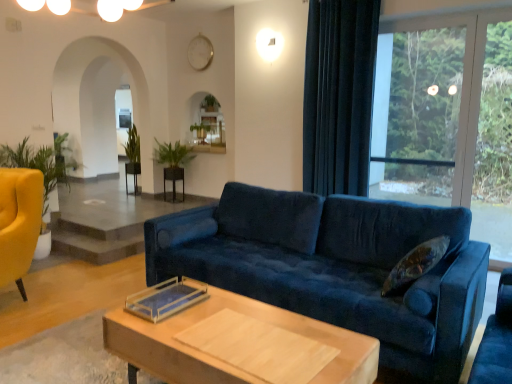
The height and width of the screenshot is (384, 512). Describe the element at coordinates (200, 52) in the screenshot. I see `silver metallic clock at upper center` at that location.

What do you see at coordinates (132, 145) in the screenshot? The image size is (512, 384). I see `green leafy plant at center, placed as the second plant when sorted from front to back` at bounding box center [132, 145].

At what (x,y) coordinates should I click in order to perform the action: click on black wood side table at center, the 1th side table from the front. Please return your answer as a coordinate pair (x, y). The height and width of the screenshot is (384, 512). Looking at the image, I should click on (174, 182).

Where is `silver metallic clock at upper center`? silver metallic clock at upper center is located at coordinates (200, 52).

Considering the relative sizes of silver metallic clock at upper center and velvet dark blue curtain at right in the image provided, is silver metallic clock at upper center smaller than velvet dark blue curtain at right?

Yes, silver metallic clock at upper center is smaller than velvet dark blue curtain at right.

From a real-world perspective, is silver metallic clock at upper center positioned above or below velvet dark blue curtain at right?

silver metallic clock at upper center is above velvet dark blue curtain at right.

Are silver metallic clock at upper center and velvet dark blue curtain at right far apart?

Yes, silver metallic clock at upper center and velvet dark blue curtain at right are quite far apart.

Consider the image. Which object is further away from the camera, light wood/wooden coffee table at center or green leafy plant at center, placed as the 2th plant when sorted from back to front?

green leafy plant at center, placed as the 2th plant when sorted from back to front, is further from the camera.

Are light wood/wooden coffee table at center and green leafy plant at center, the 1th plant when ordered from right to left, making contact?

No, light wood/wooden coffee table at center is not with green leafy plant at center, the 1th plant when ordered from right to left.

Looking at this image, who is smaller, light wood/wooden coffee table at center or green leafy plant at center, placed as the 2th plant when sorted from back to front?

green leafy plant at center, placed as the 2th plant when sorted from back to front, is smaller.

From a real-world perspective, is light wood/wooden coffee table at center physically above green leafy plant at center, which is the first plant from front to back?

No, from a real-world perspective, light wood/wooden coffee table at center is not on top of green leafy plant at center, which is the first plant from front to back.

You are a GUI agent. You are given a task and a screenshot of the screen. Output one action in this format:
    pyautogui.click(x=<x>, y=<y>)
    Task: Click on the 2nd plant behind the transparent glass window at upper right, counting from the anchor's position
    
    Given the screenshot: What is the action you would take?
    pyautogui.click(x=132, y=145)

Is green leafy plant at center, which ranks as the first plant in left-to-right order, far away from transparent glass window at upper right?

Yes, green leafy plant at center, which ranks as the first plant in left-to-right order, is far from transparent glass window at upper right.

From the image's perspective, is green leafy plant at center, placed as the second plant when sorted from front to back, located above or below transparent glass window at upper right?

Based on their image positions, green leafy plant at center, placed as the second plant when sorted from front to back, is located beneath transparent glass window at upper right.

Which of these two, velvet blue couch at center or black glossy side table at center, the first side table when ordered from left to right, is smaller?

black glossy side table at center, the first side table when ordered from left to right, is smaller.

Based on the photo, is velvet blue couch at center to the left or to the right of black glossy side table at center, the 1th side table in the back-to-front sequence, in the image?

In the image, velvet blue couch at center appears on the right side of black glossy side table at center, the 1th side table in the back-to-front sequence.

Is velvet blue couch at center taller or shorter than black glossy side table at center, which is the second side table from right to left?

Considering their sizes, velvet blue couch at center has more height than black glossy side table at center, which is the second side table from right to left.

Is velvet blue couch at center beside black glossy side table at center, the first side table when ordered from left to right?

No, velvet blue couch at center is not in contact with black glossy side table at center, the first side table when ordered from left to right.

From the image's perspective, does velvet blue couch at center appear lower than green leafy plant at center, which appears as the 2th plant when viewed from the left?

Yes, from the image's perspective, velvet blue couch at center is below green leafy plant at center, which appears as the 2th plant when viewed from the left.

Is velvet blue couch at center far from green leafy plant at center, which appears as the 2th plant when viewed from the left?

Indeed, velvet blue couch at center is not near green leafy plant at center, which appears as the 2th plant when viewed from the left.

Considering the sizes of objects velvet blue couch at center and green leafy plant at center, which is the first plant from front to back, in the image provided, who is shorter, velvet blue couch at center or green leafy plant at center, which is the first plant from front to back,?

green leafy plant at center, which is the first plant from front to back, is shorter.

From a real-world perspective, is green leafy plant at center, the second plant viewed from the right, on black glossy side table at center, which is the 2th side table from front to back?

Correct, in the physical world, green leafy plant at center, the second plant viewed from the right, is higher than black glossy side table at center, which is the 2th side table from front to back.

Is green leafy plant at center, the second plant viewed from the right, taller or shorter than black glossy side table at center, the 1th side table in the back-to-front sequence?

In the image, green leafy plant at center, the second plant viewed from the right, appears to be taller than black glossy side table at center, the 1th side table in the back-to-front sequence.

From the image's perspective, does green leafy plant at center, which ranks as the first plant in left-to-right order, appear higher than black glossy side table at center, the first side table when ordered from left to right?

Yes, from the image's perspective, green leafy plant at center, which ranks as the first plant in left-to-right order, is on top of black glossy side table at center, the first side table when ordered from left to right.

How many degrees apart are the facing directions of green leafy plant at center, arranged as the first plant when viewed from the back, and black glossy side table at center, the 1th side table in the back-to-front sequence?

0.003 degrees.

Who is shorter, light wood/wooden coffee table at center or velvet blue couch at center?

light wood/wooden coffee table at center.

The image size is (512, 384). In order to click on coffee table in front of the velvet blue couch at center in this screenshot , I will do `click(241, 345)`.

Consider the image. Which object is further away from the camera, light wood/wooden coffee table at center or velvet blue couch at center?

velvet blue couch at center is behind.

Find the location of a particular element. The width and height of the screenshot is (512, 384). curtain below the silver metallic clock at upper center (from the image's perspective) is located at coordinates (339, 95).

You are a GUI agent. You are given a task and a screenshot of the screen. Output one action in this format:
    pyautogui.click(x=<x>, y=<y>)
    Task: Click on the coffee table below the green leafy plant at center, the 1th plant when ordered from right to left (from a real-world perspective)
    
    Given the screenshot: What is the action you would take?
    pyautogui.click(x=241, y=345)

Which object lies nearer to the anchor point transparent glass window at upper right, black wood side table at center, the 1th side table viewed from the right, or green leafy plant at center, the 1th plant when ordered from right to left?

green leafy plant at center, the 1th plant when ordered from right to left, is closer to transparent glass window at upper right.

Looking at the image, which one is located further to light wood/wooden coffee table at center, velvet blue couch at center or black glossy side table at center, the first side table when ordered from left to right?

black glossy side table at center, the first side table when ordered from left to right, is positioned further to the anchor light wood/wooden coffee table at center.

When comparing their distances from transparent glass window at upper right, does silver metallic clock at upper center or light wood/wooden coffee table at center seem closer?

silver metallic clock at upper center is positioned closer to the anchor transparent glass window at upper right.

Considering their positions, is matte yellow armchair at left positioned closer to velvet dark blue curtain at right than black glossy side table at center, which is the 2th side table from front to back?

The object closer to velvet dark blue curtain at right is matte yellow armchair at left.

Considering their positions, is transparent glass window at upper right positioned closer to velvet blue couch at center than green leafy plant at center, placed as the second plant when sorted from front to back?

Based on the image, transparent glass window at upper right appears to be nearer to velvet blue couch at center.

Considering their positions, is green leafy plant at center, which appears as the 2th plant when viewed from the left, positioned closer to velvet dark blue curtain at right than silver metallic clock at upper center?

Based on the image, silver metallic clock at upper center appears to be nearer to velvet dark blue curtain at right.

Which object lies nearer to the anchor point green leafy plant at center, placed as the second plant when sorted from front to back, matte yellow armchair at left or light wood/wooden coffee table at center?

matte yellow armchair at left is positioned closer to the anchor green leafy plant at center, placed as the second plant when sorted from front to back.

Estimate the real-world distances between objects in this image. Which object is closer to light wood/wooden coffee table at center, green leafy plant at center, the 1th plant when ordered from right to left, or green leafy plant at center, which ranks as the first plant in left-to-right order?

green leafy plant at center, the 1th plant when ordered from right to left, is closer to light wood/wooden coffee table at center.

Where is `window between velvet blue couch at center and green leafy plant at center, which appears as the 2th plant when viewed from the left, along the z-axis`? window between velvet blue couch at center and green leafy plant at center, which appears as the 2th plant when viewed from the left, along the z-axis is located at coordinates (431, 105).

This screenshot has height=384, width=512. Find the location of `chair located between light wood/wooden coffee table at center and silver metallic clock at upper center in the depth direction`. chair located between light wood/wooden coffee table at center and silver metallic clock at upper center in the depth direction is located at coordinates (19, 222).

The image size is (512, 384). I want to click on curtain between silver metallic clock at upper center and transparent glass window at upper right in the horizontal direction, so click(339, 95).

Image resolution: width=512 pixels, height=384 pixels. I want to click on curtain located between matte yellow armchair at left and transparent glass window at upper right in the left-right direction, so click(339, 95).